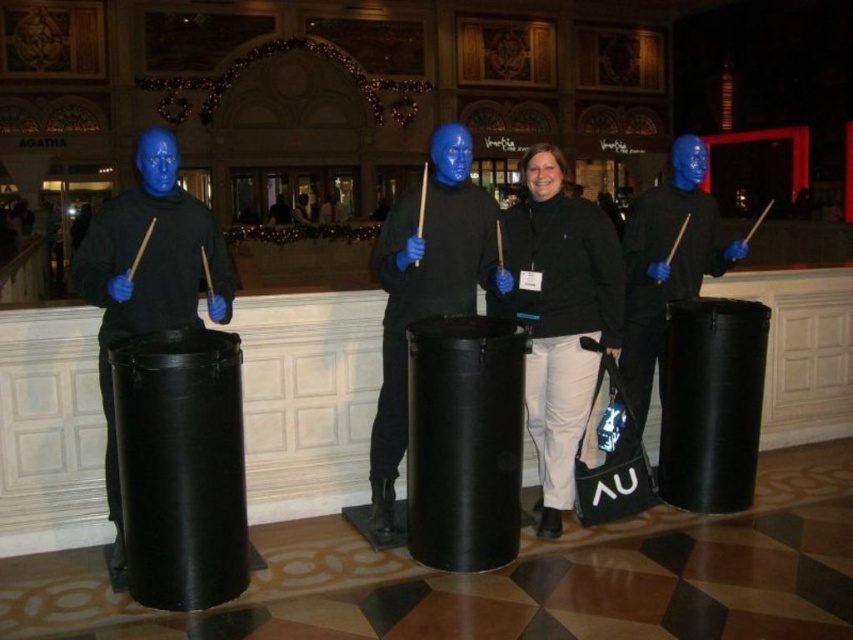
You are a photographer standing at the entrance of the room. You want to take a photo that includes both the matte black drum at left and the matte black drum at center. The camera you are using has a maximum focus range of 3 meters. Can you capture both drums in the same photo without moving your position?

The matte black drum at left is 3.84 meters away from the matte black drum at center. Since the distance between them exceeds the camera maximum focus range of 3 meters, you cannot capture both drums in the same photo without moving your position.

You are a stage director planning to place a 6 meter long banner between the matte black drum at left and the matte black drum at right. Can the banner fit between them without overlapping the drums?

The distance between the matte black drum at left and the matte black drum at right is 5.51 meters. Since the banner is 6 meters long, it is slightly longer than the available space. Therefore, the banner cannot fit between them without overlapping the drums.

You are a photographer setting up for a group photo. You need to ensure that the black matte jacket at center and the matte black drum at center are both visible in the frame. Given their height difference, where should you position your camera to capture both subjects adequately?

Since the black matte jacket at center is shorter than the matte black drum at center, positioning the camera at a lower angle will allow the jacket to be seen above the drum, ensuring both are visible in the frame.